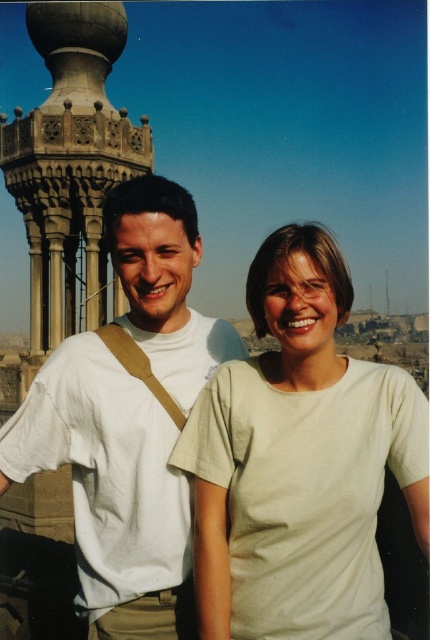
Question: Which point is closer to the camera?

Choices:
 (A) (95, 564)
 (B) (359, 461)

Answer: (A)

Question: Can you confirm if white matte t-shirt at center is thinner than white cotton shirt at center?

Choices:
 (A) yes
 (B) no

Answer: (B)

Question: Which object appears closest to the camera in this image?

Choices:
 (A) white cotton shirt at center
 (B) white matte t-shirt at center

Answer: (B)

Question: Among these points, which one is farthest from the camera?

Choices:
 (A) (399, 387)
 (B) (5, 432)

Answer: (A)

Question: Can you confirm if white matte t-shirt at center is positioned below white cotton shirt at center?

Choices:
 (A) no
 (B) yes

Answer: (B)

Question: Does white matte t-shirt at center appear under white cotton shirt at center?

Choices:
 (A) yes
 (B) no

Answer: (A)